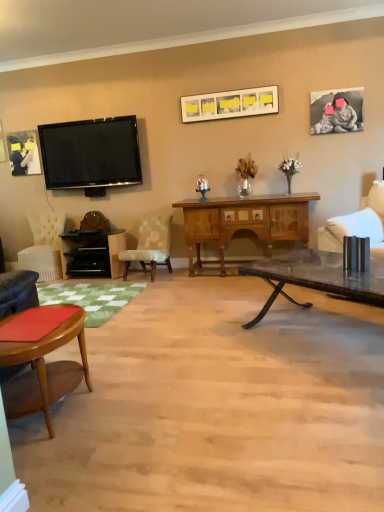
Question: Is flat screen tv at upper left at the back of transparent glass coffee table at center?

Choices:
 (A) no
 (B) yes

Answer: (A)

Question: Considering the relative positions of transparent glass coffee table at center and flat screen tv at upper left in the image provided, is transparent glass coffee table at center to the right of flat screen tv at upper left from the viewer's perspective?

Choices:
 (A) yes
 (B) no

Answer: (A)

Question: Is there a large distance between transparent glass coffee table at center and flat screen tv at upper left?

Choices:
 (A) yes
 (B) no

Answer: (A)

Question: Is transparent glass coffee table at center behind flat screen tv at upper left?

Choices:
 (A) yes
 (B) no

Answer: (B)

Question: Is transparent glass coffee table at center taller than flat screen tv at upper left?

Choices:
 (A) yes
 (B) no

Answer: (B)

Question: From a real-world perspective, does transparent glass coffee table at center sit lower than flat screen tv at upper left?

Choices:
 (A) no
 (B) yes

Answer: (B)

Question: Is white fabric chair at right, the first chair positioned from the right, shorter than wooden cabinet at center?

Choices:
 (A) no
 (B) yes

Answer: (B)

Question: Does white fabric chair at right, the first chair positioned from the right, have a lesser width compared to wooden cabinet at center?

Choices:
 (A) no
 (B) yes

Answer: (B)

Question: Can you confirm if white fabric chair at right, the third chair when ordered from back to front, is positioned to the right of wooden cabinet at center?

Choices:
 (A) yes
 (B) no

Answer: (A)

Question: Can wooden cabinet at center be found inside white fabric chair at right, positioned as the fourth chair in left-to-right order?

Choices:
 (A) yes
 (B) no

Answer: (B)

Question: Is the depth of white fabric chair at right, positioned as the fourth chair in left-to-right order, greater than that of wooden cabinet at center?

Choices:
 (A) yes
 (B) no

Answer: (B)

Question: Is white fabric chair at right, positioned as the fourth chair in left-to-right order, wider than wooden cabinet at center?

Choices:
 (A) yes
 (B) no

Answer: (B)

Question: Can you confirm if white fabric chair at right, the first chair positioned from the right, is smaller than matte black picture frame at upper left, the 1th picture frame in the left-to-right sequence?

Choices:
 (A) no
 (B) yes

Answer: (A)